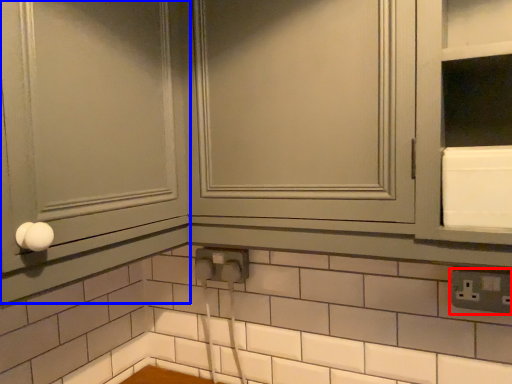
Question: Which point is closer to the camera, electric outlet (highlighted by a red box) or screen door (highlighted by a blue box)?

Choices:
 (A) electric outlet
 (B) screen door

Answer: (B)